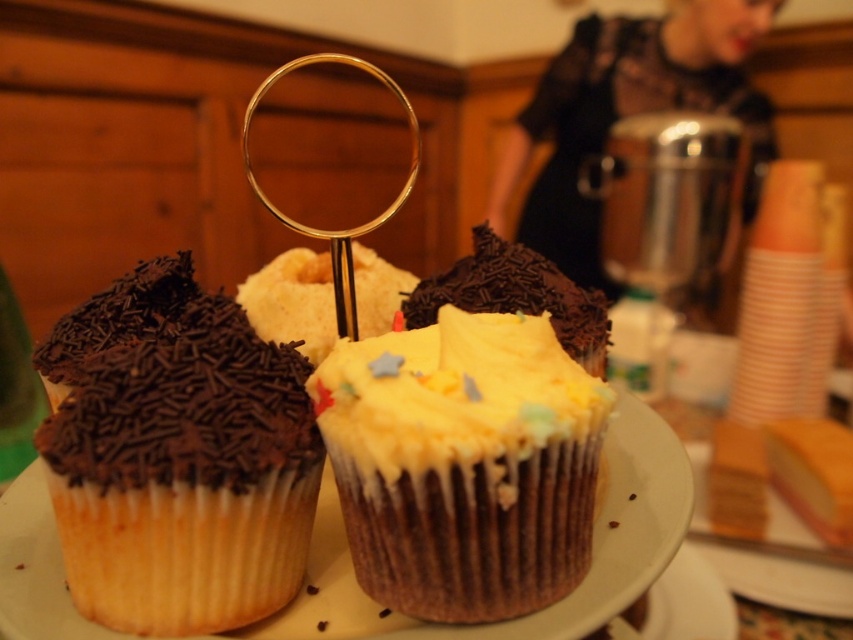
Question: Is matte chocolate muffin at center to the right of gold metallic magnifying glass at center from the viewer's perspective?

Choices:
 (A) yes
 (B) no

Answer: (A)

Question: Which object is positioned farthest from the black lace dress at upper center?

Choices:
 (A) gold metallic magnifying glass at center
 (B) chocolate sprinkled cupcake at left

Answer: (B)

Question: Which of these objects is positioned farthest from the matte chocolate muffin at center?

Choices:
 (A) yellow frosted cupcake at center
 (B) black lace dress at upper center
 (C) gold metallic magnifying glass at center

Answer: (C)

Question: Is gold metallic magnifying glass at center positioned before yellow frosted cupcake at center?

Choices:
 (A) yes
 (B) no

Answer: (B)

Question: Among these objects, which one is nearest to the camera?

Choices:
 (A) yellow frosted cupcake at center
 (B) chocolate sprinkled cupcake at left

Answer: (B)

Question: Is chocolate sprinkled cupcake at left positioned before yellow frosted cupcake at center?

Choices:
 (A) yes
 (B) no

Answer: (A)